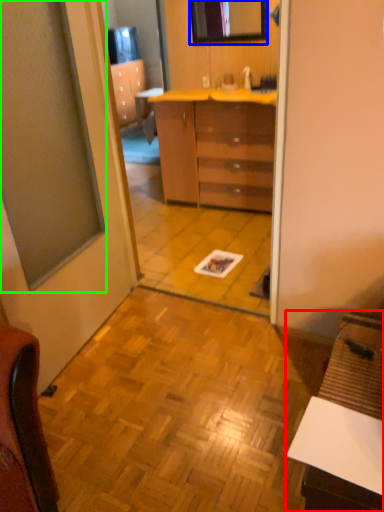
Question: Based on their relative distances, which object is nearer to desk (highlighted by a red box)? Choose from mirror (highlighted by a blue box) and window (highlighted by a green box).

Choices:
 (A) mirror
 (B) window

Answer: (B)